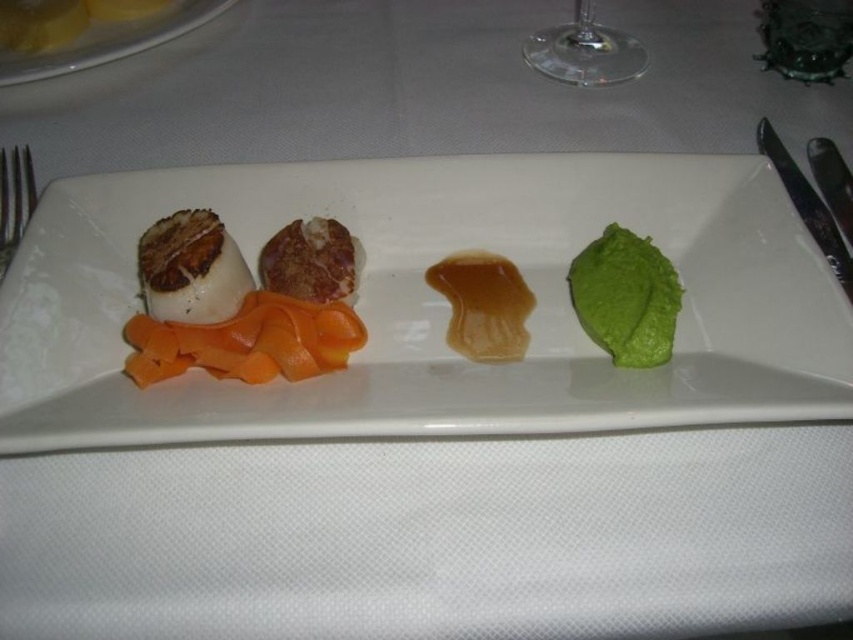
You are a food critic analyzing the dish. The translucent amber sauce at center and the brown crispy meat at center are both placed on the plate. Which one has a larger surface area covering the plate?

The translucent amber sauce at center might be wider than brown crispy meat at center according to the description.

You are a food critic evaluating this dish. You notice two points on the plate at coordinates point [473,276] and point [799,195]. Which point is closer to your viewpoint as you look at the dish?

Point [473,276] is closer to the camera than point [799,195], so the point at [473,276] is closer to your viewpoint.